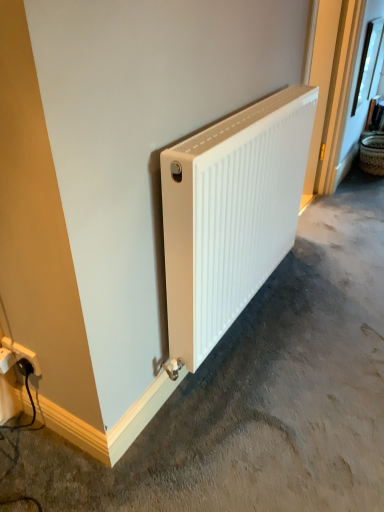
Question: Can you confirm if white matte radiator at center is positioned to the right of white matte radiator at center?

Choices:
 (A) no
 (B) yes

Answer: (A)

Question: Is the position of white matte radiator at center less distant than that of white matte radiator at center?

Choices:
 (A) yes
 (B) no

Answer: (B)

Question: Would you consider white matte radiator at center to be distant from white matte radiator at center?

Choices:
 (A) no
 (B) yes

Answer: (A)

Question: Considering the relative sizes of white matte radiator at center and white matte radiator at center in the image provided, is white matte radiator at center thinner than white matte radiator at center?

Choices:
 (A) no
 (B) yes

Answer: (B)

Question: From the image's perspective, is white matte radiator at center below white matte radiator at center?

Choices:
 (A) no
 (B) yes

Answer: (A)

Question: From a real-world perspective, is white matte radiator at center positioned above or below clear glass window at upper right?

Choices:
 (A) above
 (B) below

Answer: (B)

Question: From the image's perspective, relative to clear glass window at upper right, is white matte radiator at center above or below?

Choices:
 (A) above
 (B) below

Answer: (B)

Question: From their relative heights in the image, would you say white matte radiator at center is taller or shorter than clear glass window at upper right?

Choices:
 (A) tall
 (B) short

Answer: (B)

Question: Visually, is white matte radiator at center positioned to the left or to the right of clear glass window at upper right?

Choices:
 (A) right
 (B) left

Answer: (B)

Question: In terms of height, does white matte radiator at center look taller or shorter compared to white matte radiator at center?

Choices:
 (A) short
 (B) tall

Answer: (A)

Question: Looking at their shapes, would you say white matte radiator at center is wider or thinner than white matte radiator at center?

Choices:
 (A) thin
 (B) wide

Answer: (B)

Question: Looking at the image, does white matte radiator at center seem bigger or smaller compared to white matte radiator at center?

Choices:
 (A) small
 (B) big

Answer: (B)

Question: Considering the positions of point (352, 458) and point (271, 169), is point (352, 458) closer or farther from the camera than point (271, 169)?

Choices:
 (A) closer
 (B) farther

Answer: (A)

Question: Does point (375, 65) appear closer or farther from the camera than point (178, 247)?

Choices:
 (A) closer
 (B) farther

Answer: (B)

Question: Is clear glass window at upper right to the left or to the right of white matte radiator at center in the image?

Choices:
 (A) left
 (B) right

Answer: (B)